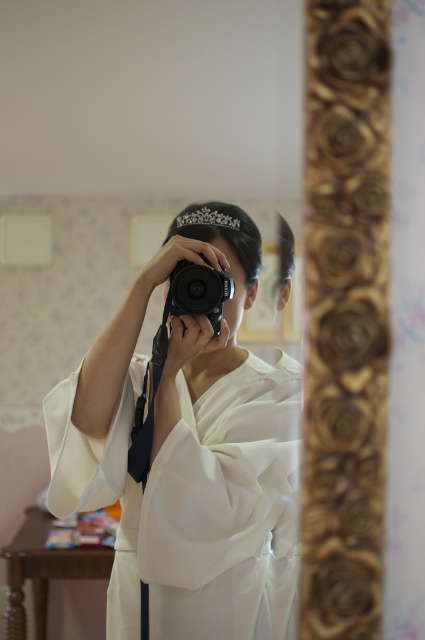
You are a photographer trying to capture the reflection of the white satin kimono at center and the black plastic camera at center in the mirror. According to the scene, which object is positioned to the left of the other?

The white satin kimono at center is positioned on the left side of black plastic camera at center.

You are a photographer trying to capture the reflection of the white satin kimono at center and the black plastic camera at center in the mirror. Based on their positions, which object will appear higher in the mirror?

The black plastic camera at center appears higher in the mirror because the white satin kimono at center is located below it.

You are a photographer trying to capture a mirror selfie. You have a white satin kimono at center and a camera. How far apart should you hold the camera from the kimono to ensure the reflection in the mirror captures both items clearly?

The white satin kimono at center and camera are 3.72 feet apart, so you should hold the camera 3.72 feet away from the kimono to ensure both are clearly reflected in the mirror.